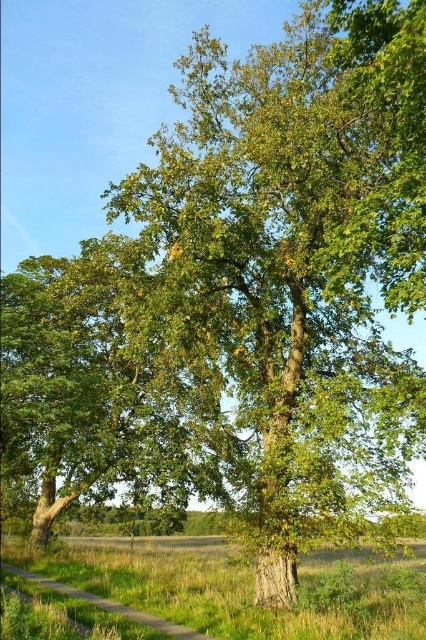
Who is higher up, green grass at lower left or green grassy path at lower left?

Positioned higher is green grassy path at lower left.

Is green grass at lower left above green grassy path at lower left?

Actually, green grass at lower left is below green grassy path at lower left.

Is point (397, 576) closer to camera compared to point (51, 580)?

Yes, it is in front of point (51, 580).

Identify the location of green grass at lower left. The height and width of the screenshot is (640, 426). (242, 589).